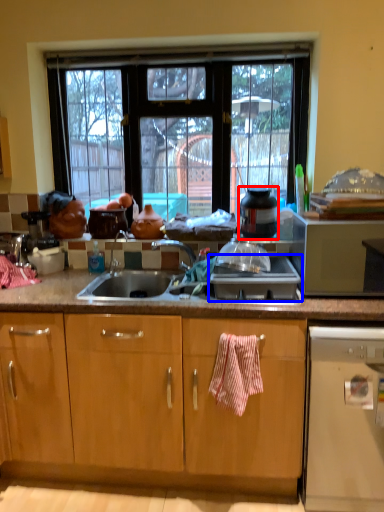
Question: Which object appears closest to the camera in this image, appliance (highlighted by a red box) or gas stove (highlighted by a blue box)?

Choices:
 (A) appliance
 (B) gas stove

Answer: (B)